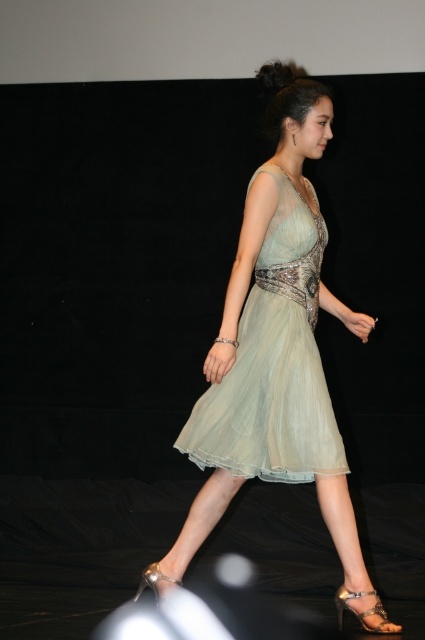
Who is positioned more to the left, light green sheer dress at center or satin gold sandal at lower center?

light green sheer dress at center is more to the left.

The width and height of the screenshot is (425, 640). What do you see at coordinates (274, 342) in the screenshot?
I see `light green sheer dress at center` at bounding box center [274, 342].

At what (x,y) coordinates should I click in order to perform the action: click on light green sheer dress at center. Please return your answer as a coordinate pair (x, y). Looking at the image, I should click on (274, 342).

Does light green sheer dress at center have a lesser width compared to metallic silver sandal at lower center?

In fact, light green sheer dress at center might be wider than metallic silver sandal at lower center.

I want to click on light green sheer dress at center, so tap(274, 342).

Can you confirm if satin dress at center is positioned above metallic silver sandal at lower center?

Yes, satin dress at center is above metallic silver sandal at lower center.

Which is behind, point (255, 384) or point (153, 579)?

Point (153, 579)

Find the location of `satin dress at center`. satin dress at center is located at coordinates (274, 364).